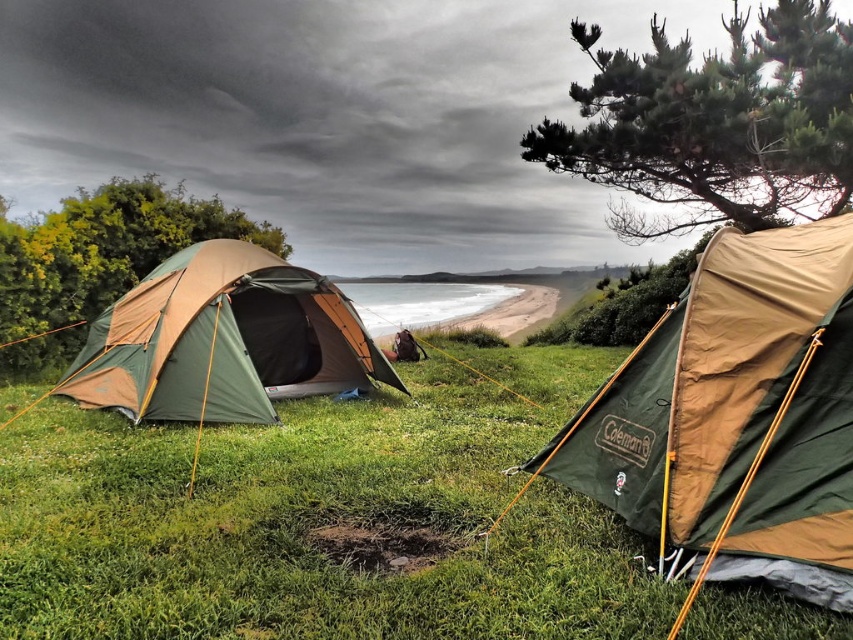
You are standing at the beach in the camping scene. You see two points marked in the image. The first point is at coordinate point (721, 157) and the second is at point (126, 221). If you want to walk towards the point that is closer to you, which coordinate should you head towards?

You should head towards point (126, 221) because it is closer to you than point (721, 157).

You are a hiker who wants to take a photo of the green textured tree at upper right and the green grassy at center. Which object should you focus on first if you want to capture both in a single frame without moving the camera?

You should focus on the green grassy at center first because it is positioned on the left side of the green textured tree at upper right, so by centering the green grassy at center in the frame, you can adjust the camera to include both objects without moving it.